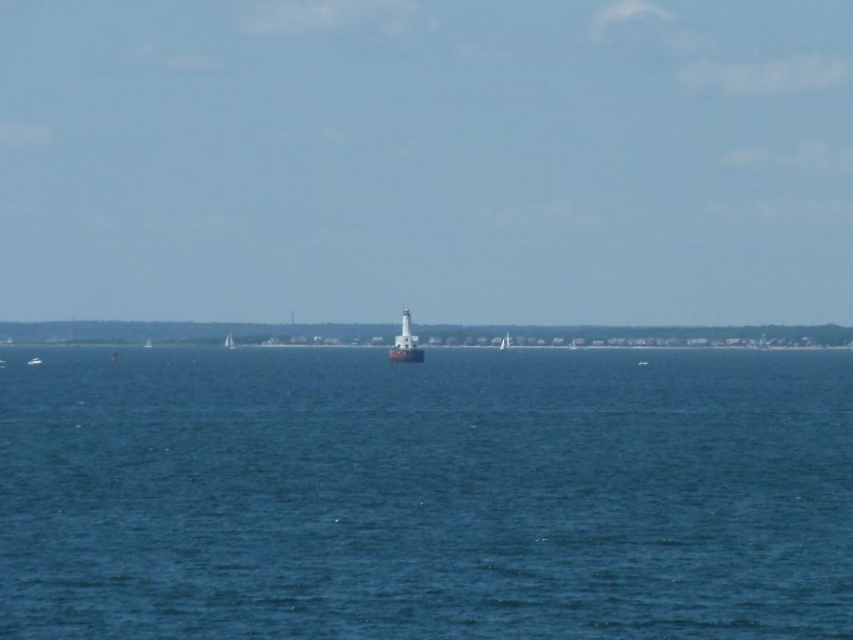
Question: Which object appears farthest from the camera in this image?

Choices:
 (A) smooth sand at center
 (B) blue water at center
 (C) white matte lighthouse at center

Answer: (A)

Question: Can you confirm if blue water at center is positioned to the left of smooth sand at center?

Choices:
 (A) yes
 (B) no

Answer: (B)

Question: From the image, what is the correct spatial relationship of smooth sand at center in relation to white matte sailboat at center?

Choices:
 (A) left
 (B) right

Answer: (B)

Question: Where is blue water at center located in relation to white matte sailboat at center in the image?

Choices:
 (A) left
 (B) right

Answer: (B)

Question: Which point is closer to the camera taking this photo?

Choices:
 (A) (505, 349)
 (B) (405, 358)
 (C) (538, 564)
 (D) (223, 346)

Answer: (C)

Question: Which of these objects is positioned closest to the white matte lighthouse at center?

Choices:
 (A) white sailboat at center
 (B) blue water at center
 (C) white matte sailboat at center
 (D) white sailboat at left

Answer: (B)